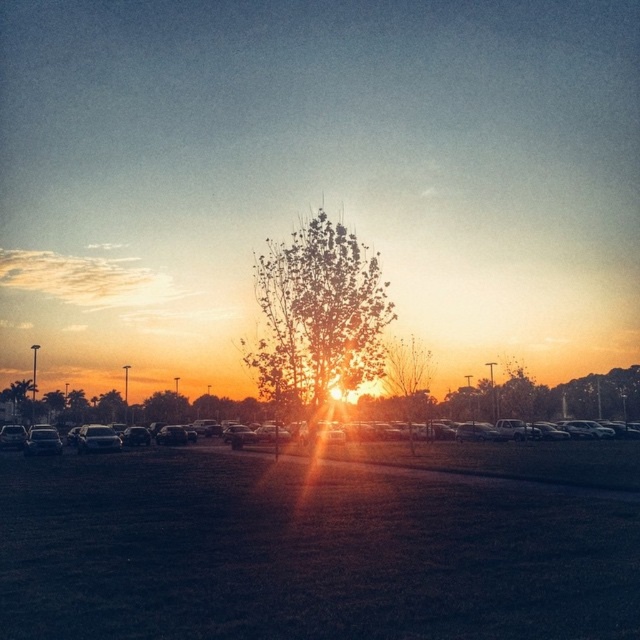
Question: Does green leafy tree at center have a smaller size compared to metallic cars at center?

Choices:
 (A) yes
 (B) no

Answer: (A)

Question: In this image, where is green leafy tree at center located relative to metallic cars at center?

Choices:
 (A) above
 (B) below

Answer: (A)

Question: Can you confirm if green leafy tree at center is thinner than metallic cars at center?

Choices:
 (A) yes
 (B) no

Answer: (A)

Question: Which point appears farthest from the camera in this image?

Choices:
 (A) (464, 428)
 (B) (273, 323)

Answer: (A)